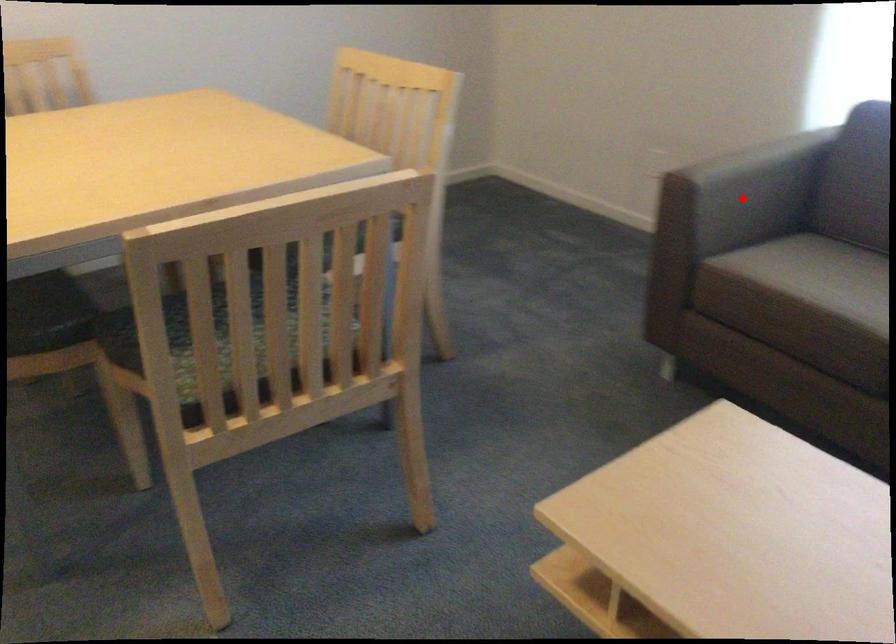
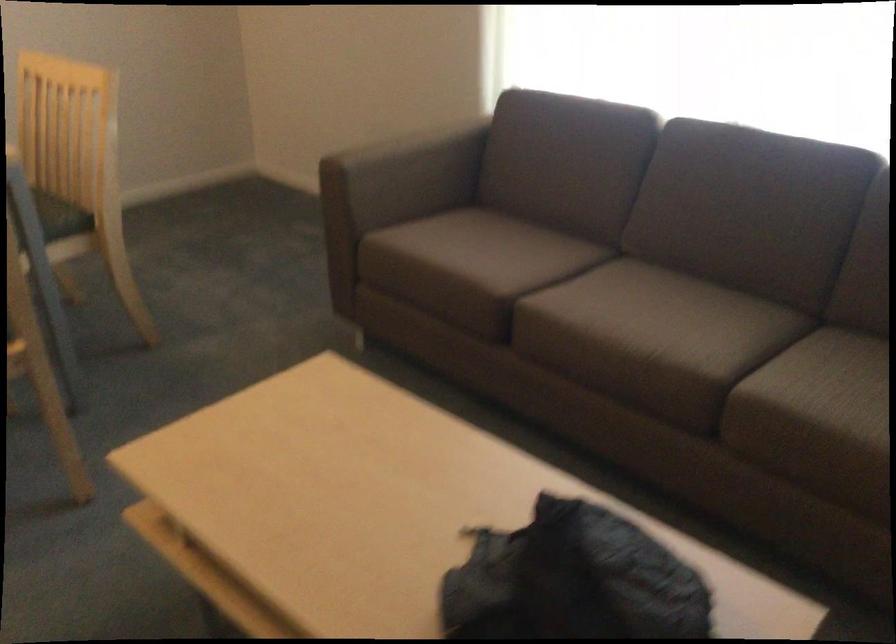
In the second image, find the point that corresponds to the highlighted location in the first image.

(403, 176)